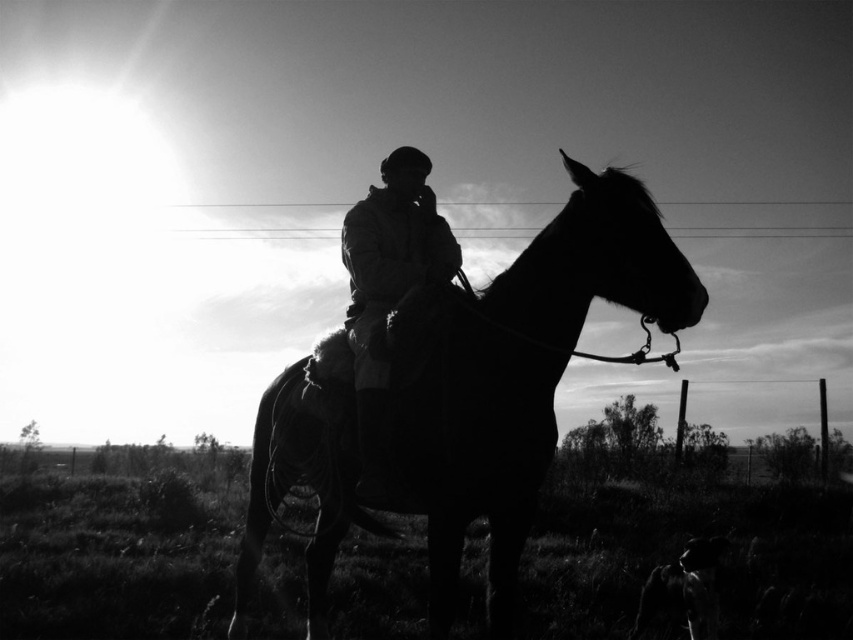
Question: Among these points, which one is nearest to the camera?

Choices:
 (A) (430, 280)
 (B) (415, 484)

Answer: (B)

Question: Among these objects, which one is nearest to the camera?

Choices:
 (A) silhouette leather jacket at center
 (B) silhouette glossy horse at center

Answer: (B)

Question: In this image, where is silhouette glossy horse at center located relative to silhouette leather jacket at center?

Choices:
 (A) below
 (B) above

Answer: (A)

Question: Is silhouette glossy horse at center above silhouette leather jacket at center?

Choices:
 (A) yes
 (B) no

Answer: (B)

Question: Which of the following is the closest to the observer?

Choices:
 (A) silhouette glossy horse at center
 (B) silhouette leather jacket at center

Answer: (A)

Question: Is silhouette glossy horse at center positioned at the back of silhouette leather jacket at center?

Choices:
 (A) no
 (B) yes

Answer: (A)